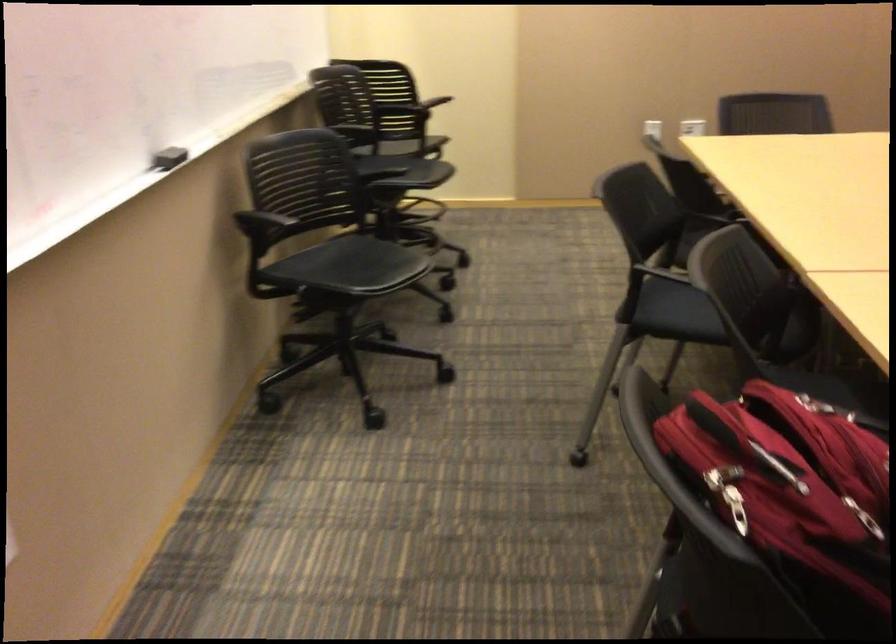
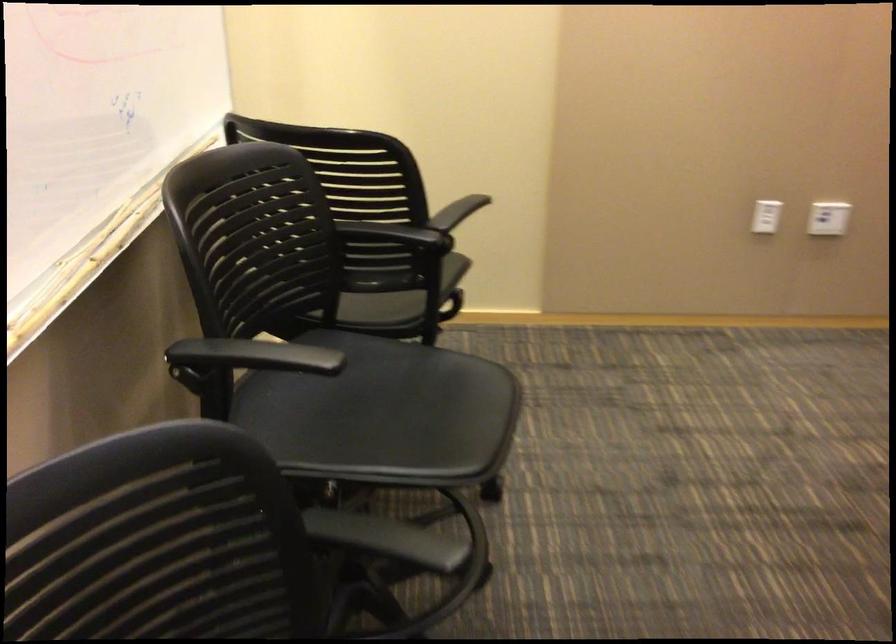
Question: The images are taken continuously from a first-person perspective. In which direction are you moving?

Choices:
 (A) Left
 (B) Right
 (C) Forward
 (D) Backward

Answer: (C)